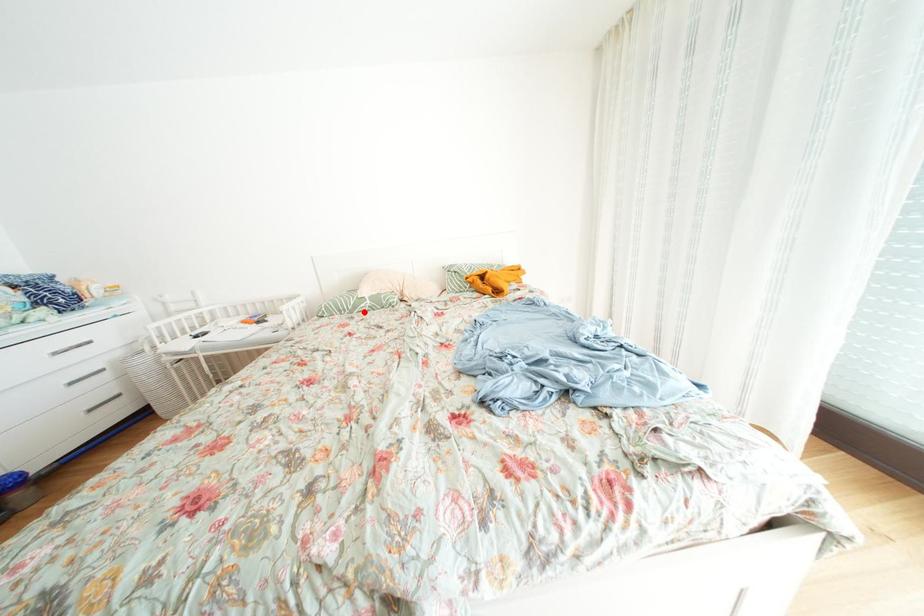
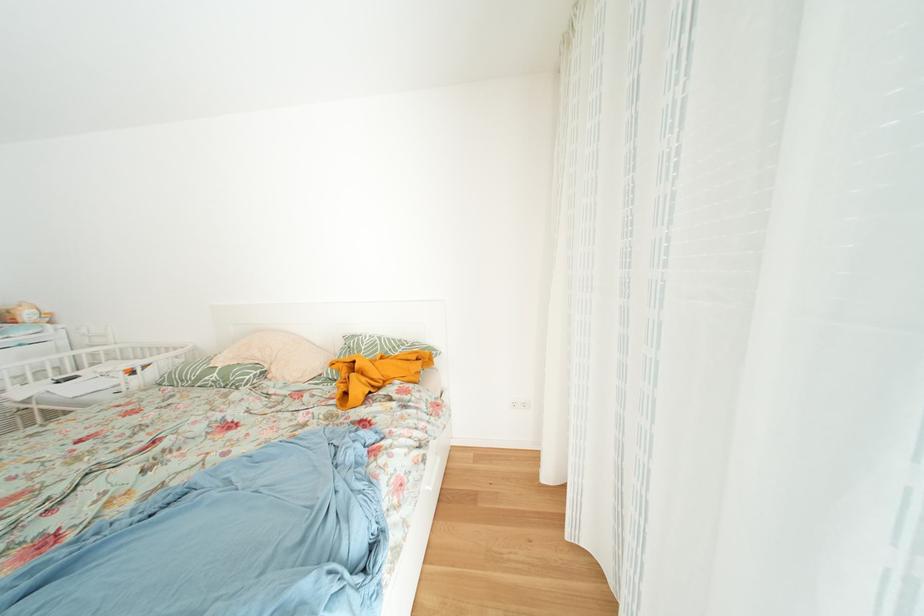
The point at the highlighted location is marked in the first image. Where is the corresponding point in the second image?

(208, 384)